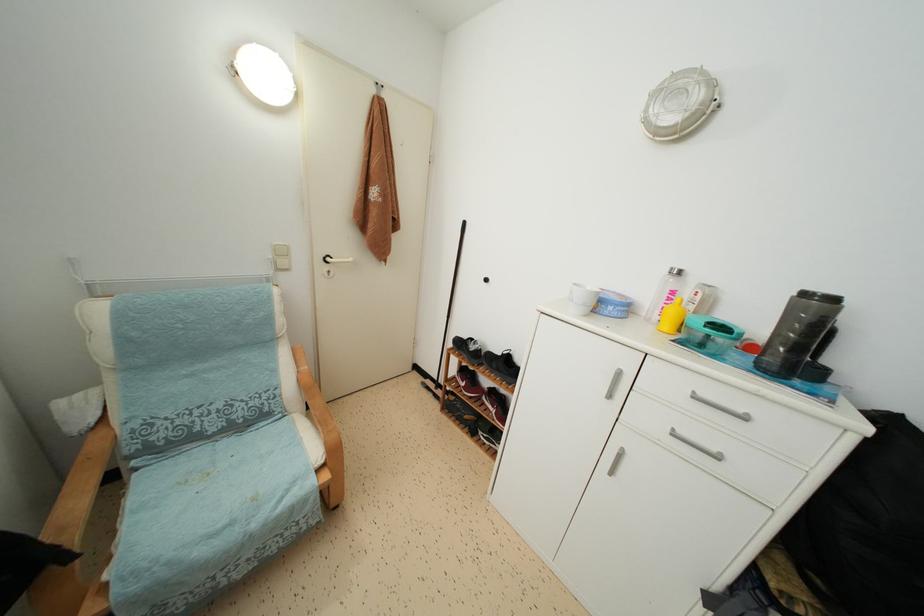
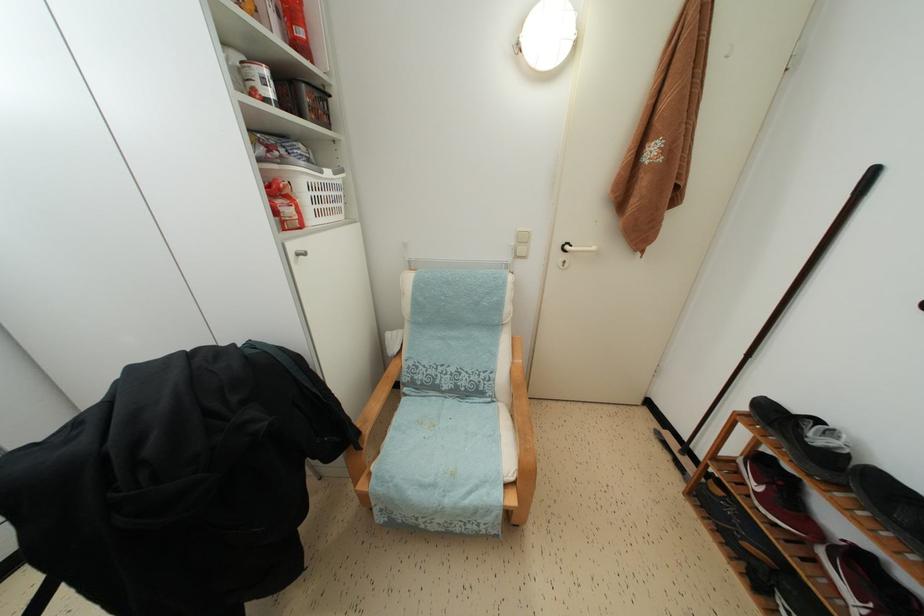
In the second image, find the point that corresponds to (476,345) in the first image.

(821, 427)